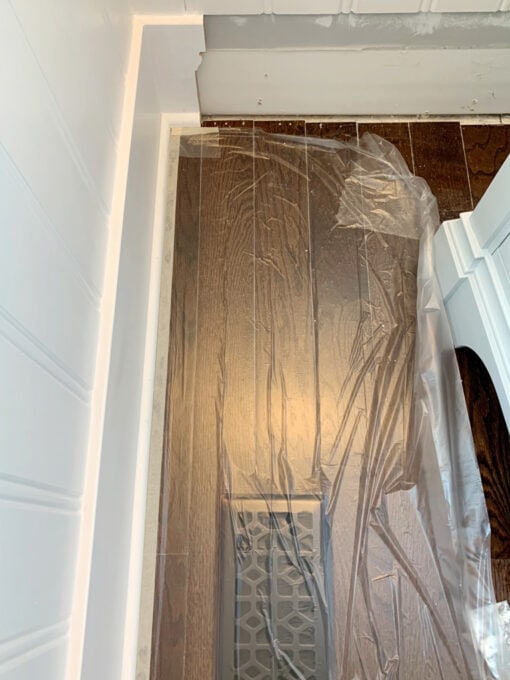
At what (x,y) coordinates should I click in order to perform the action: click on floor covering. Please return your answer as a coordinate pair (x, y). This screenshot has width=510, height=680. Looking at the image, I should click on (301, 400).